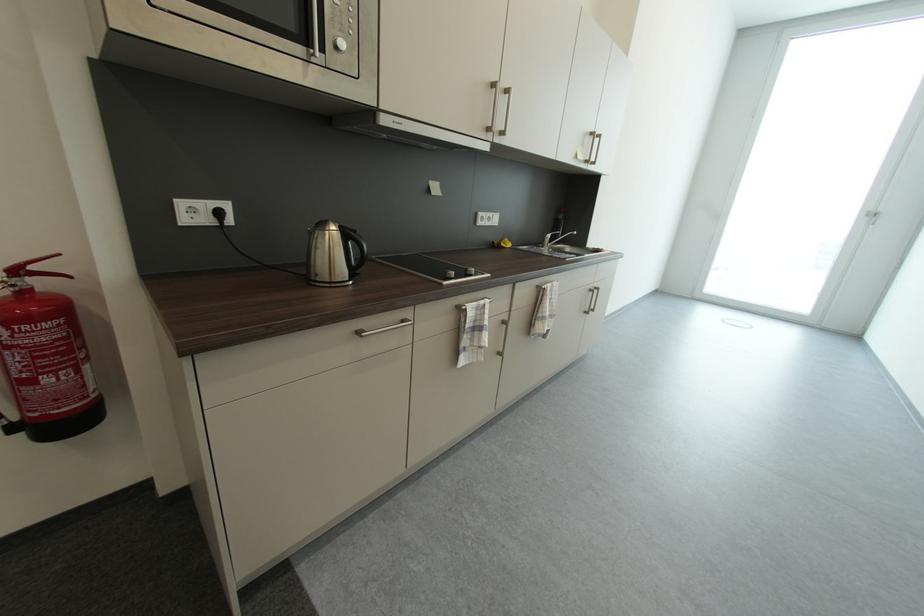
Find the location of `microwave control buttons`. microwave control buttons is located at coordinates (344, 23).